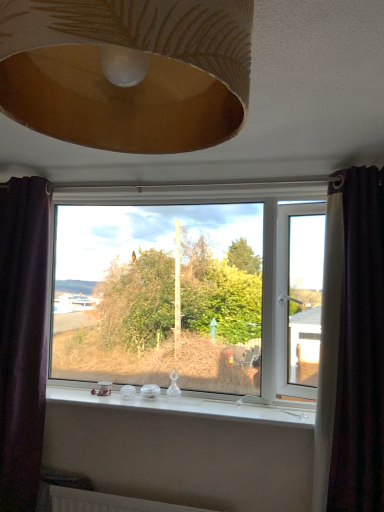
Question: Considering the positions of point (19, 481) and point (276, 408), is point (19, 481) closer or farther from the camera than point (276, 408)?

Choices:
 (A) closer
 (B) farther

Answer: (A)

Question: Considering the positions of purple fabric curtain at left, positioned as the 1th curtain in left-to-right order, and white glossy window sill at center in the image, is purple fabric curtain at left, positioned as the 1th curtain in left-to-right order, wider or thinner than white glossy window sill at center?

Choices:
 (A) wide
 (B) thin

Answer: (B)

Question: Based on their relative distances, which object is farther from the white glossy window sill at center?

Choices:
 (A) transparent glass window at center
 (B) purple fabric curtain at left, marked as the 2th curtain in a right-to-left arrangement
 (C) gold textured lampshade at upper center
 (D) dark purple velvet curtain at right, which is counted as the first curtain, starting from the right

Answer: (C)

Question: Estimate the real-world distances between objects in this image. Which object is closer to the white glossy window sill at center?

Choices:
 (A) purple fabric curtain at left, marked as the 2th curtain in a right-to-left arrangement
 (B) dark purple velvet curtain at right, which is counted as the first curtain, starting from the right
 (C) transparent glass window at center
 (D) gold textured lampshade at upper center

Answer: (C)